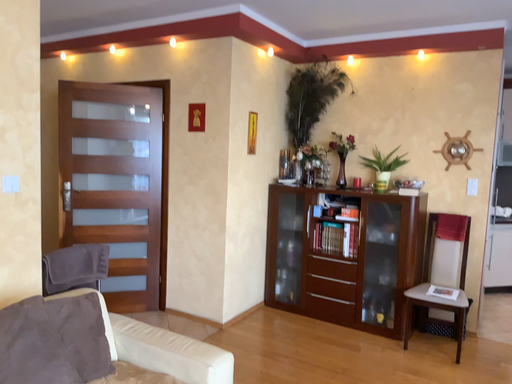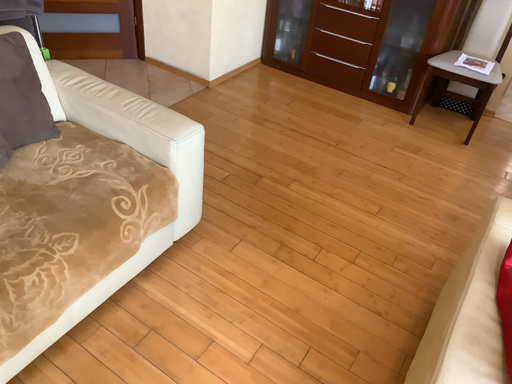
Question: Which way did the camera rotate in the video?

Choices:
 (A) rotated upward
 (B) rotated downward

Answer: (B)